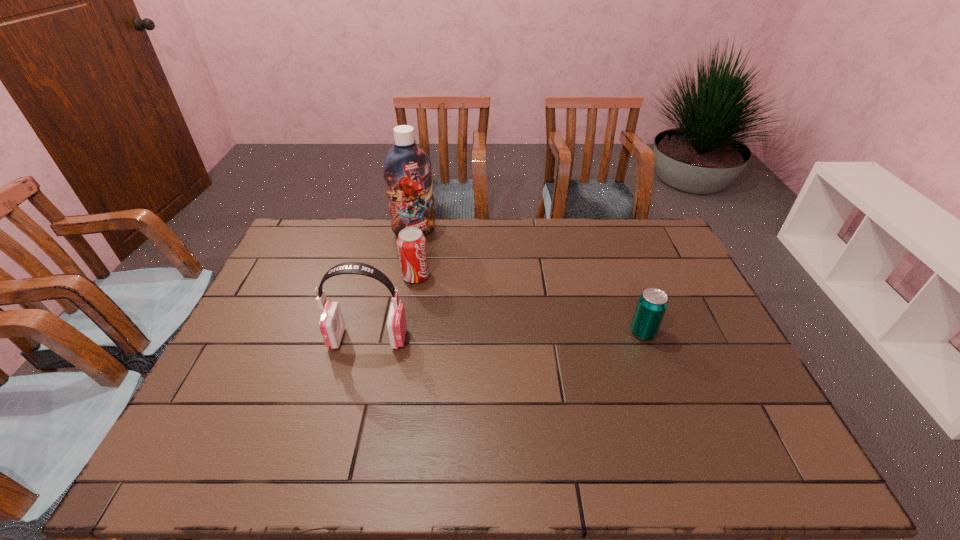
In the image, there is a desktop. Where is `free space at the left edge`? The image size is (960, 540). free space at the left edge is located at coordinates (290, 259).

You are a GUI agent. You are given a task and a screenshot of the screen. Output one action in this format:
    pyautogui.click(x=<x>, y=<y>)
    Task: Click on the free space at the right edge of the desktop
    
    Given the screenshot: What is the action you would take?
    pyautogui.click(x=674, y=329)

Locate an element on the screen. vacant space at the far left corner of the desktop is located at coordinates (327, 223).

Find the location of `free region at the near right corner`. free region at the near right corner is located at coordinates (695, 399).

Find the location of `empty space that is in between the shampoo and the rightmost object`. empty space that is in between the shampoo and the rightmost object is located at coordinates (529, 282).

This screenshot has height=540, width=960. I want to click on free spot between the tallest object and the shortest object, so click(x=529, y=282).

Locate an element on the screen. blank region between the third shortest object and the rightmost object is located at coordinates (506, 336).

Where is `vacant space in between the beer can and the third tallest object`? This screenshot has height=540, width=960. vacant space in between the beer can and the third tallest object is located at coordinates (529, 305).

This screenshot has width=960, height=540. In order to click on vacant region between the shortest object and the earphone in this screenshot , I will do `click(506, 336)`.

The height and width of the screenshot is (540, 960). What are the coordinates of `free spot between the farthest object and the rightmost object` in the screenshot? It's located at (529, 282).